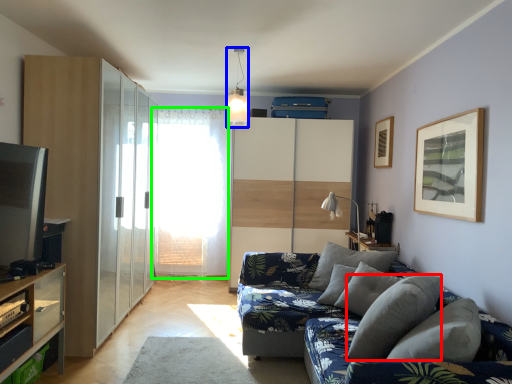
Question: Which object is the closest to the pillow (highlighted by a red box)? Choose among these: light fixture (highlighted by a blue box) or window screen (highlighted by a green box).

Choices:
 (A) light fixture
 (B) window screen

Answer: (A)